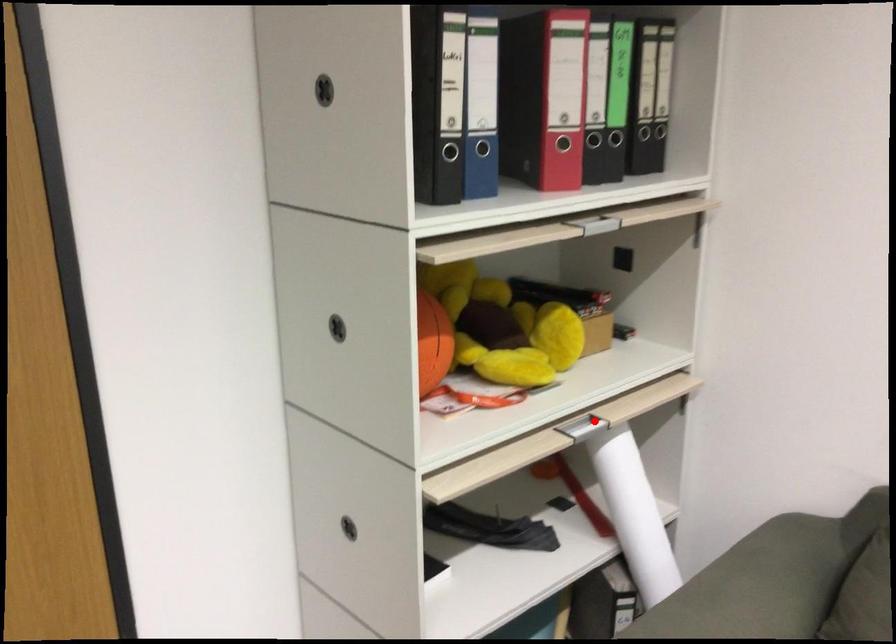
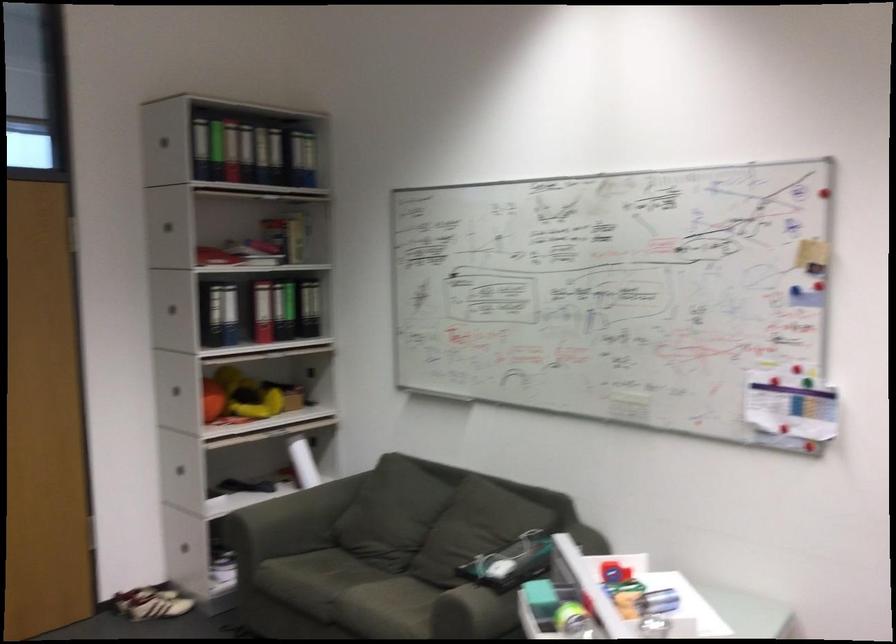
Question: I am providing you with two images of the same scene from different viewpoints. A red point is marked on the first image. At the location where the point appears in image 1, is it still visible in image 2?

Choices:
 (A) Yes
 (B) No

Answer: (B)